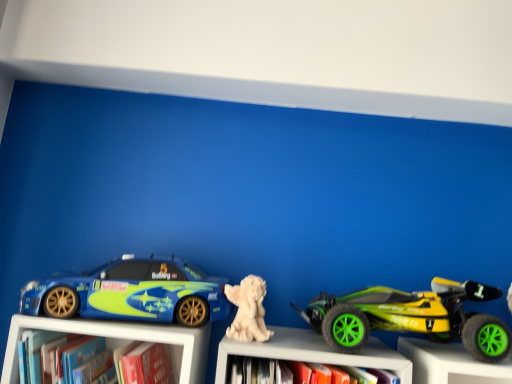
Question: Is white matte statue at center, the 2th toy when ordered from right to left, taller or shorter than hardcover book at lower left?

Choices:
 (A) tall
 (B) short

Answer: (B)

Question: From a real-world perspective, is white matte statue at center, the 2th toy when ordered from right to left, above or below hardcover book at lower left?

Choices:
 (A) above
 (B) below

Answer: (A)

Question: Which object is positioned farthest from the green rubber toy car at right, positioned as the 1th toy in right-to-left order?

Choices:
 (A) shiny blue car at left
 (B) white matte statue at center
 (C) hardcover book at lower left
 (D) white matte statue at center, the 2th toy when ordered from right to left

Answer: (C)

Question: Considering the real-world distances, which object is farthest from the white matte statue at center?

Choices:
 (A) green rubber toy car at right, the 2th toy from the left
 (B) white matte statue at center, which appears as the 1th toy when viewed from the left
 (C) shiny blue car at left
 (D) hardcover book at lower left

Answer: (D)